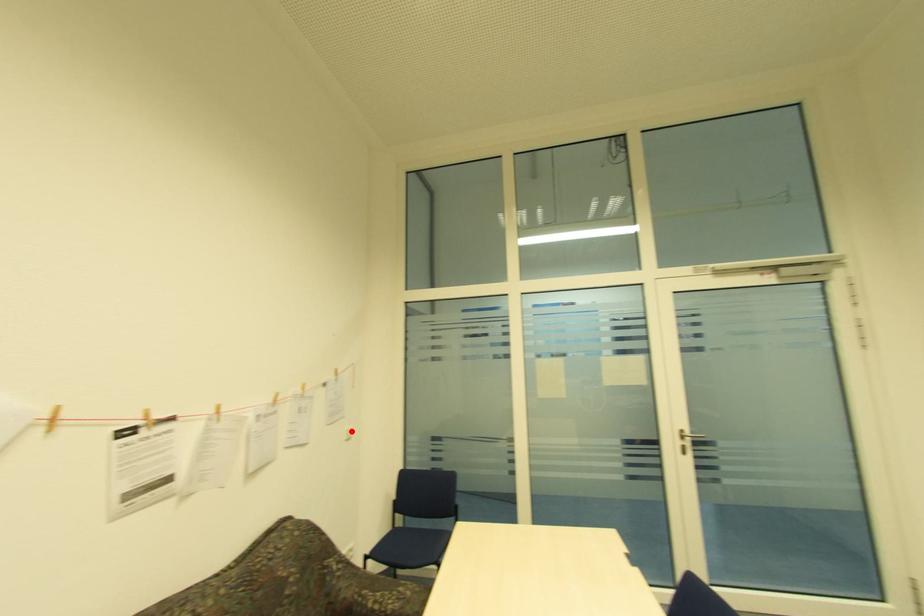
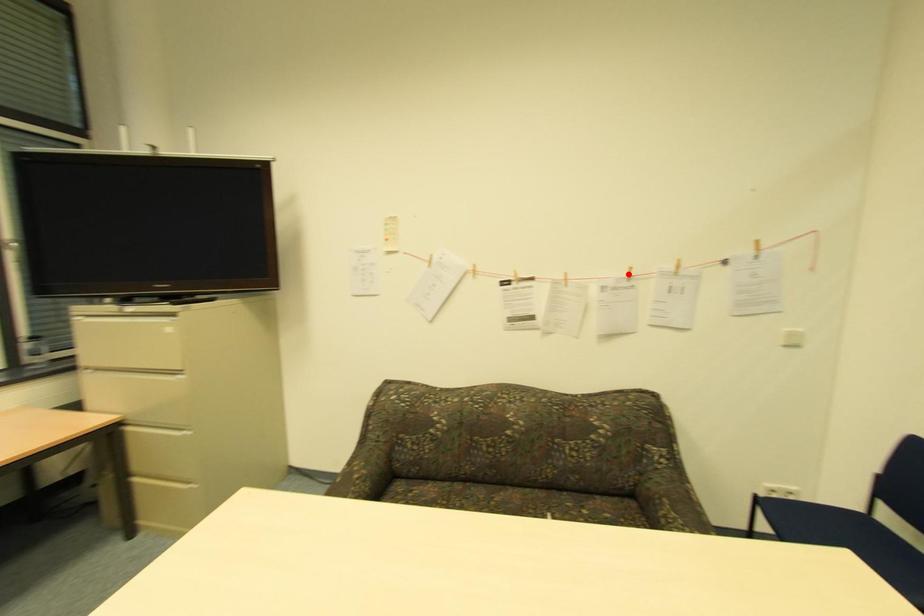
I am providing you with two images of the same scene from different viewpoints. A red point is marked on the first image and another point is marked on the second image. Is the red point in image1 aligned with the point shown in image2?

No